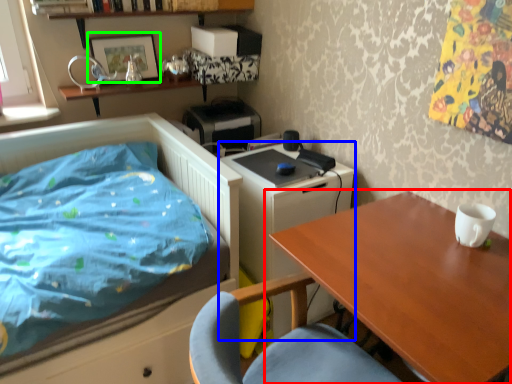
Question: Based on their relative distances, which object is nearer to table (highlighted by a red box)? Choose from changing table (highlighted by a blue box) and picture frame (highlighted by a green box).

Choices:
 (A) changing table
 (B) picture frame

Answer: (A)